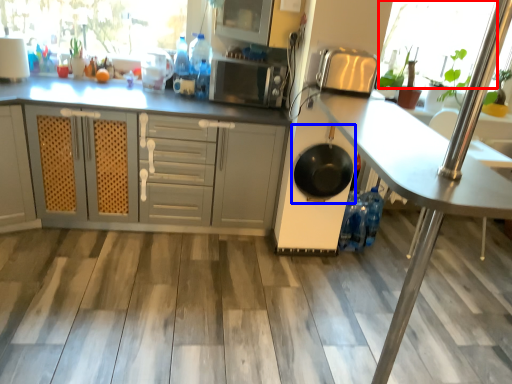
Question: Which point is closer to the camera, window screen (highlighted by a red box) or frying pan (highlighted by a blue box)?

Choices:
 (A) window screen
 (B) frying pan

Answer: (B)